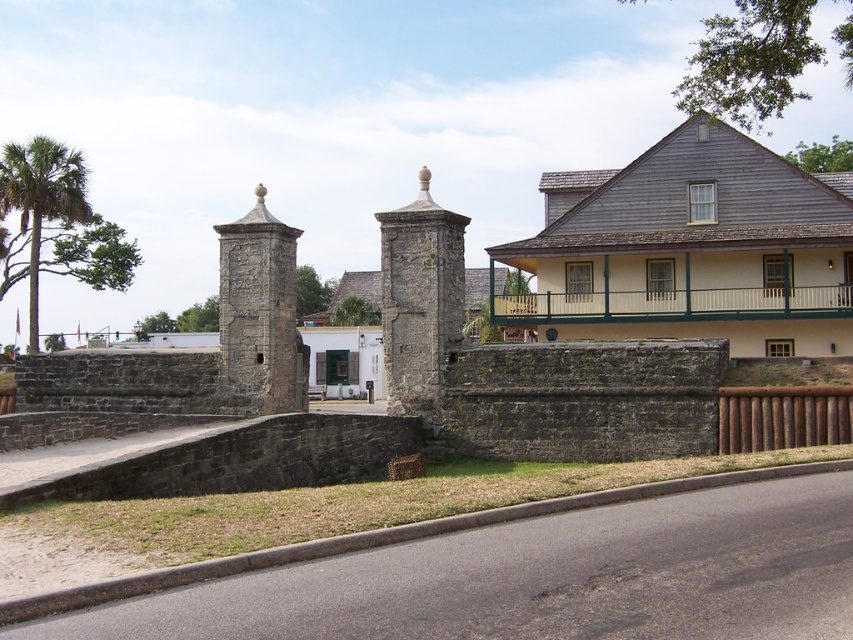
You are standing at the entrance of a historical site and want to take a photo of the stone textured gate at center. If you are currently 100 feet away from the gate, should you move closer or farther away to ensure the gate fills the frame better in your camera?

The stone textured gate at center is currently 81.86 feet away from the camera. Since you are 100 feet away, you should move closer to the gate to ensure it fills the frame better.

Consider the image. You are a visitor approaching the stone structure and want to enter through the entrance. Which object, the stone textured gate at center or the rustic stone tower at left, should you go through to enter?

You should go through the stone textured gate at center because it is larger in size compared to the rustic stone tower at left, making it the entrance point.

You are standing in front of the stone structure and want to take a photo. There are two points marked in the image, point 1 at coordinates point (450, 257) and point 2 at coordinates point (283, 376). Which point will appear larger in your photo?

Point 1 at coordinates point (450, 257) will appear larger in the photo because it is closer to the camera than point 2 at coordinates point (283, 376).